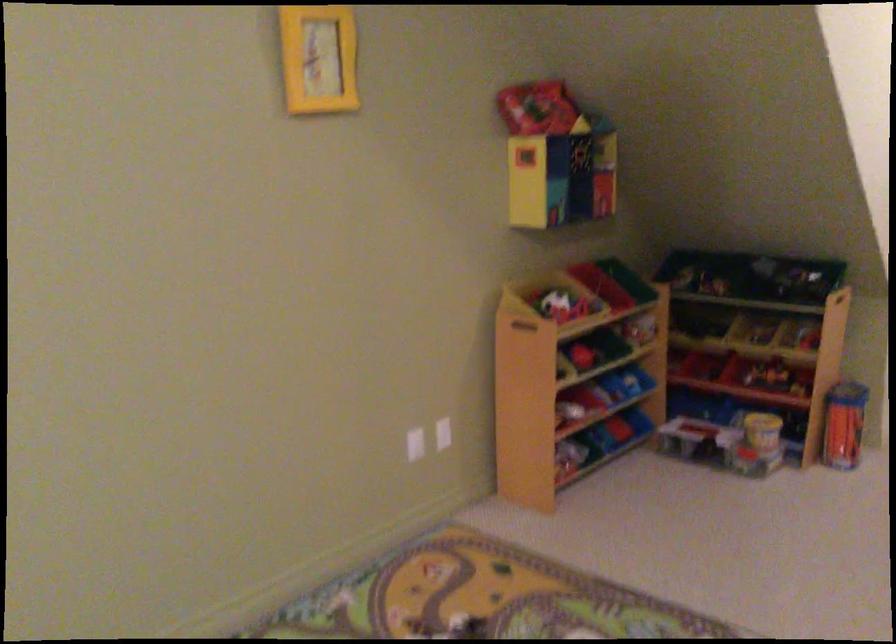
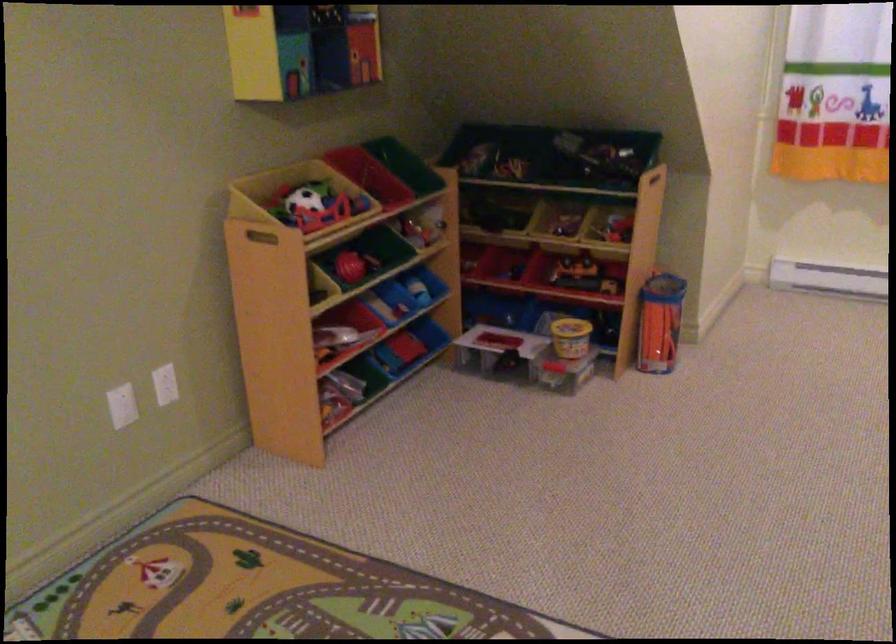
In a continuous first-person perspective shot, in which direction is the camera moving?

The cameraman moved toward right, forward.